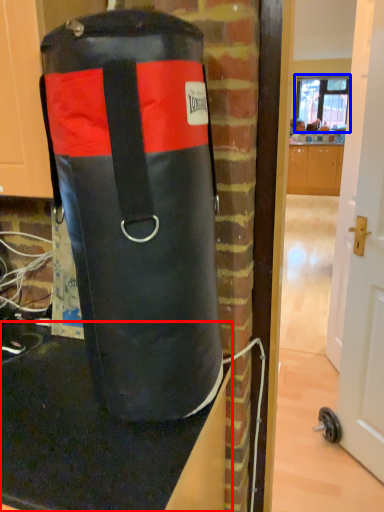
Question: Which of the following is the closest to the observer, table top (highlighted by a red box) or window screen (highlighted by a blue box)?

Choices:
 (A) table top
 (B) window screen

Answer: (A)